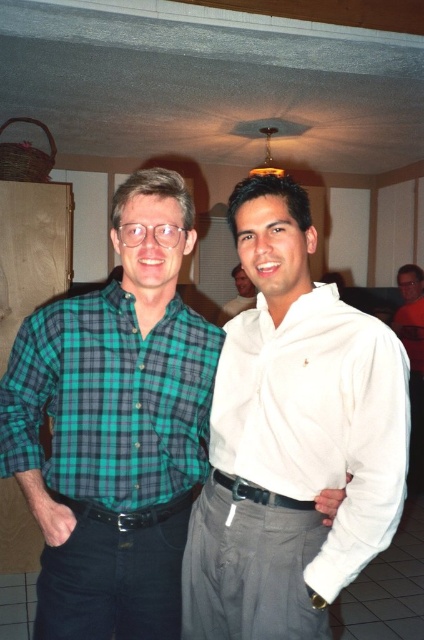
Question: Is green plaid shirt at left positioned behind orange t-shirt at right?

Choices:
 (A) yes
 (B) no

Answer: (B)

Question: Can you confirm if green plaid shirt at center is positioned below green plaid shirt at left?

Choices:
 (A) no
 (B) yes

Answer: (B)

Question: Which object is positioned farthest from the white cotton shirt at center?

Choices:
 (A) green plaid shirt at left
 (B) white matte shirt at center
 (C) orange t-shirt at right
 (D) green plaid shirt at center

Answer: (C)

Question: Which point is closer to the camera taking this photo?

Choices:
 (A) (245, 284)
 (B) (209, 451)
 (C) (401, 324)

Answer: (B)

Question: Which object is the farthest from the white cotton shirt at center?

Choices:
 (A) white matte shirt at center
 (B) green plaid shirt at left
 (C) orange t-shirt at right

Answer: (C)

Question: Is green plaid shirt at center above green plaid shirt at left?

Choices:
 (A) yes
 (B) no

Answer: (B)